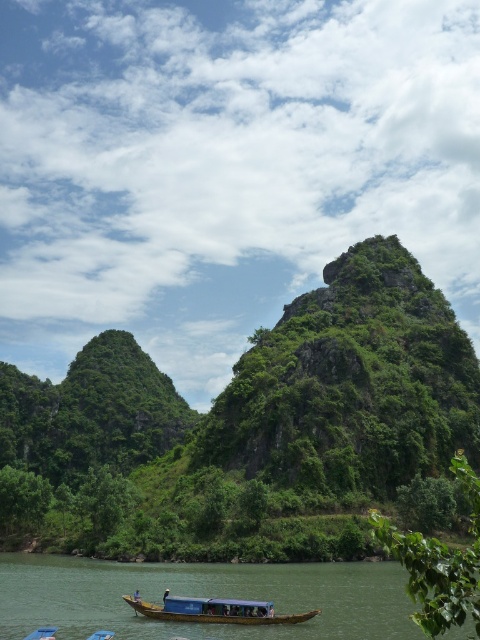
Question: Does green wooden boat at lower center have a smaller size compared to blue wooden boat at lower center?

Choices:
 (A) no
 (B) yes

Answer: (A)

Question: Does blue wooden boat at lower center have a lesser width compared to wooden boat at lower center?

Choices:
 (A) no
 (B) yes

Answer: (A)

Question: Estimate the real-world distances between objects in this image. Which object is closer to the green wooden boat at lower center?

Choices:
 (A) wooden boat at lower center
 (B) green leafy vegetation at center

Answer: (A)

Question: Observing the image, what is the correct spatial positioning of blue wooden boat at lower center in reference to wooden boat at lower center?

Choices:
 (A) below
 (B) above

Answer: (A)

Question: Which point is closer to the camera?

Choices:
 (A) green leafy vegetation at center
 (B) blue wooden boat at lower center

Answer: (B)

Question: Which point appears closest to the camera in this image?

Choices:
 (A) (40, 628)
 (B) (132, 600)
 (C) (338, 582)

Answer: (A)